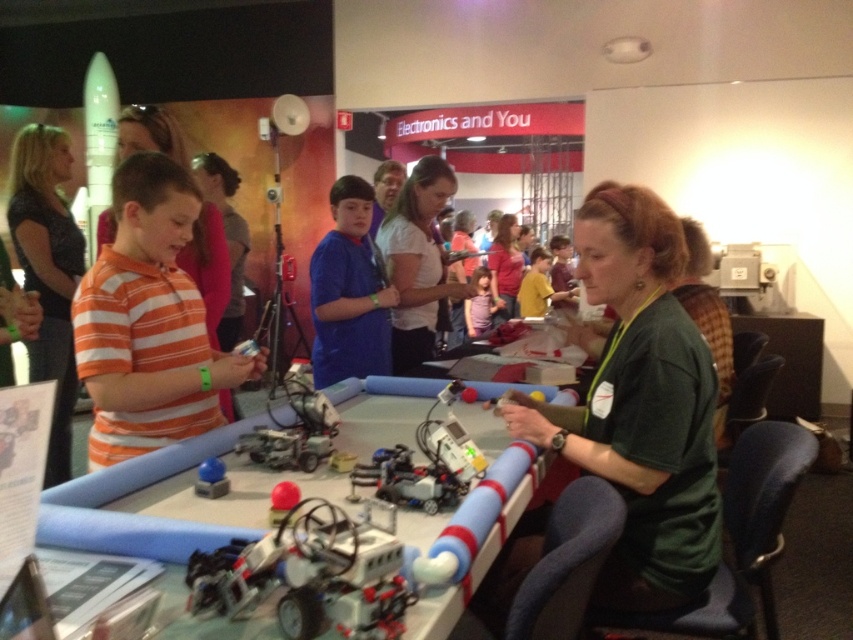
You are an attendee at the science fair and you see the white matte shirt at center and the matte blue button at lower left. Which object is located more to the left?

The matte blue button at lower left is more to the left than the white matte shirt at center.

You are standing in front of the table with the LEGO robots. There is a point marked at coordinates (418, 260). What object is located at that point?

The point at coordinates (418, 260) marks the white matte shirt at center.